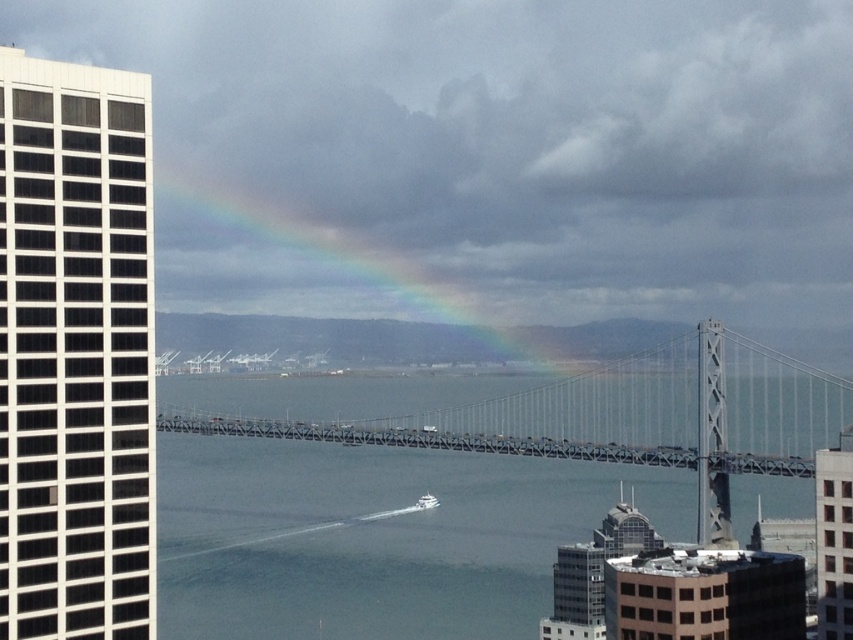
Is rainbow at upper center positioned behind white glossy boat at center?

No, rainbow at upper center is in front of white glossy boat at center.

Between rainbow at upper center and white glossy boat at center, which one is positioned higher?

rainbow at upper center is above.

Between point (578, 340) and point (425, 493), which one is positioned behind?

Positioned behind is point (578, 340).

This screenshot has width=853, height=640. Identify the location of rainbow at upper center. (375, 339).